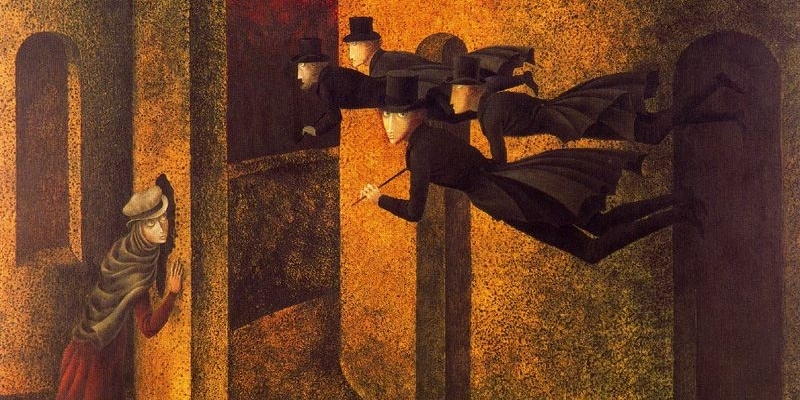
I want to click on wainscoting, so click(310, 154), click(242, 166).